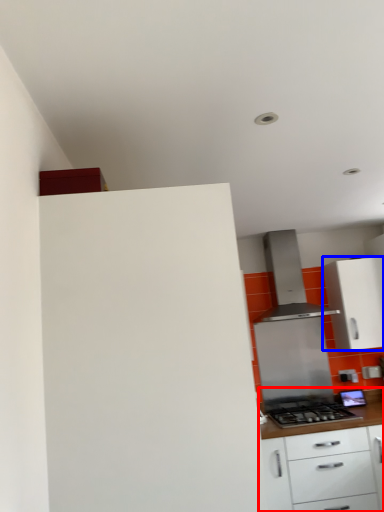
Question: Among these objects, which one is nearest to the camera, cabinetry (highlighted by a red box) or cabinetry (highlighted by a blue box)?

Choices:
 (A) cabinetry
 (B) cabinetry

Answer: (A)